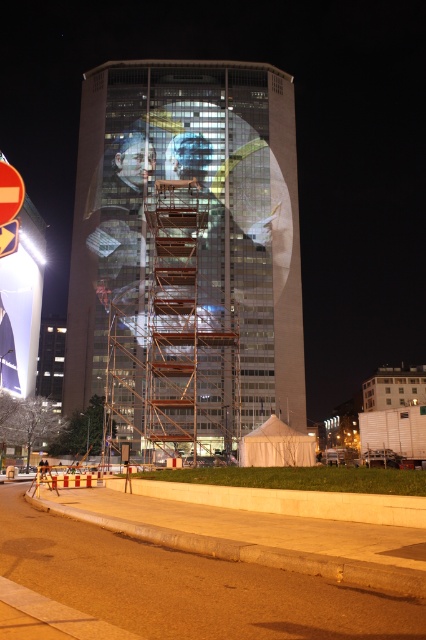
You are a window cleaner who needs to clean the windows of the matte glass tower at center and the rustic metal scaffolding at center. Based on the scene, which object is higher up and requires you to climb more stairs to reach?

The matte glass tower at center is above the rustic metal scaffolding at center, so you will need to climb more stairs to reach the windows of the matte glass tower at center.

You are a delivery drone that needs to fly through the space between the matte glass tower at center and the metal scaffolding at center. Based on the scene description, can you safely pass through this gap?

The metal scaffolding at center is behind the matte glass tower at center, so there is no gap between them for the drone to pass through safely.

You are standing at the entrance of the building and want to take a photo of the large portrait projection on the building facade. However, there is a metal scaffolding at center blocking your view. Based on its position, can you estimate whether the scaffolding is in the foreground or background relative to the building?

The metal scaffolding at center is located at point (186, 586), which places it in the foreground relative to the building, meaning it is closer to you and blocking the view of the building facade.